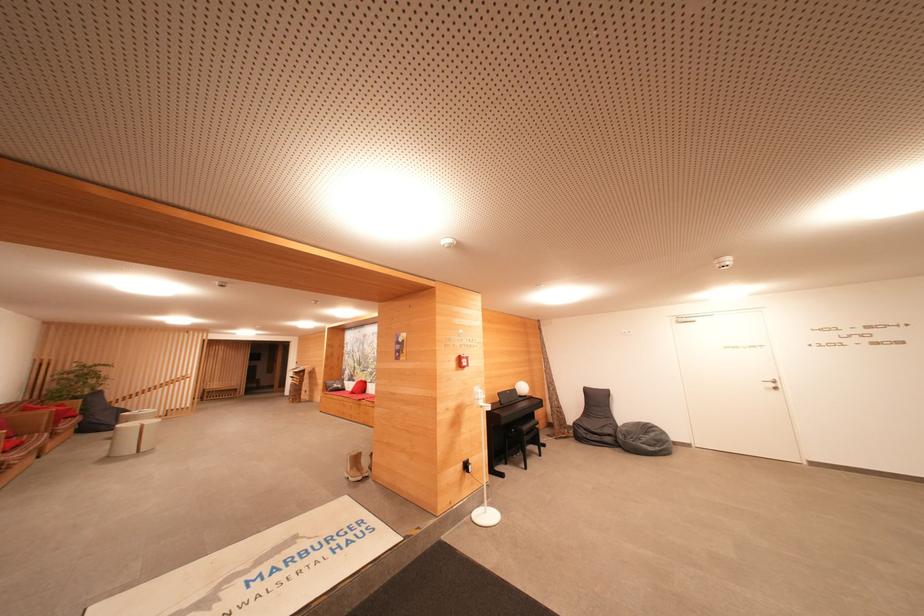
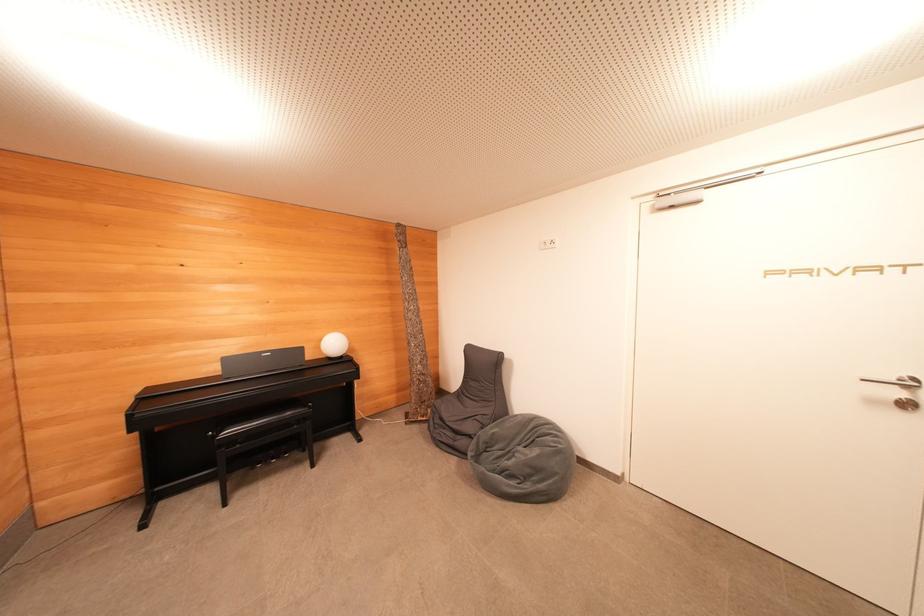
In a continuous first-person perspective shot, in which direction is the camera moving?

The cameraman walked toward right, forward.